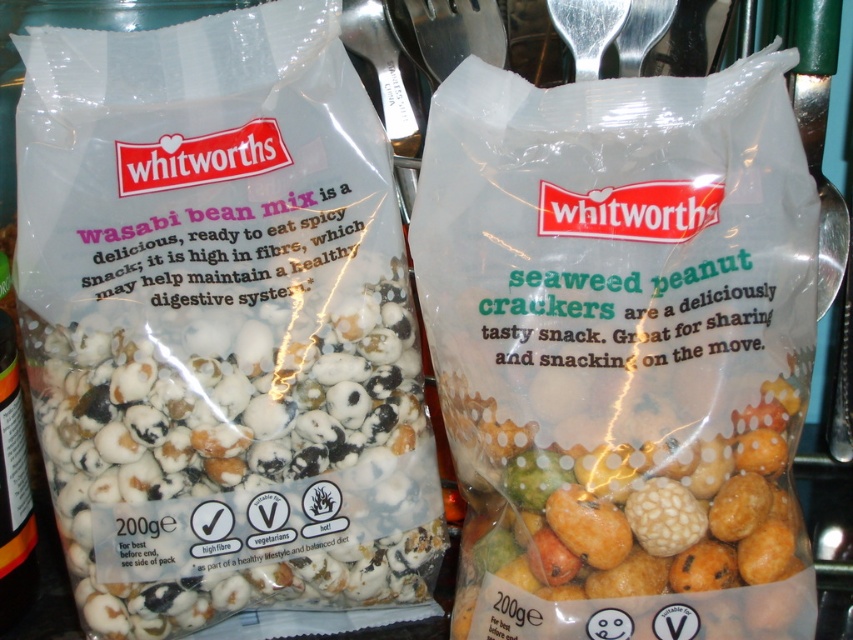
You are a quality inspector checking the packaging of Whitworths snacks. The left package has a point marked at coordinates (239,461). What product is located at this point?

The point at coordinates (239,461) corresponds to the white matte popcorn mix at left.

You are a store employee arranging snacks on a shelf. You have a white matte popcorn mix at left and multicolored textured crackers at center. The shelf is 12 inches wide. If you want to place both items side by side without overlapping, will they fit?

The white matte popcorn mix at left and multicolored textured crackers at center are 7.99 inches apart from each other. Since the shelf is 12 inches wide, they can be placed side by side with enough space between them.

You are looking at the Whitworths Wasabi Bean Mix package. There are two points marked on the package. One is at coordinate point (x=164, y=589) and the other is at point (x=592, y=449). From your perspective, which point is closer to you?

Point (x=592, y=449) is closer to you because point (x=164, y=589) is behind it.